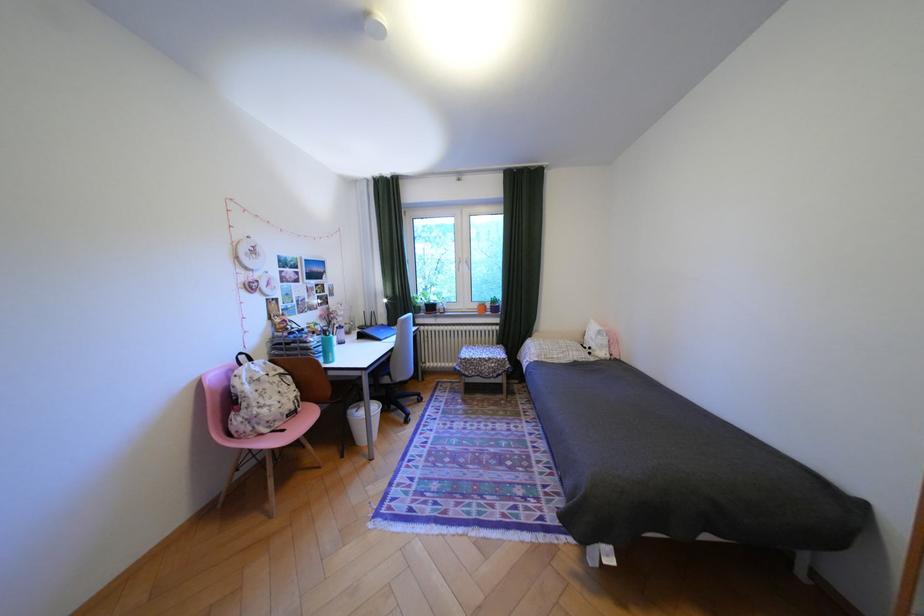
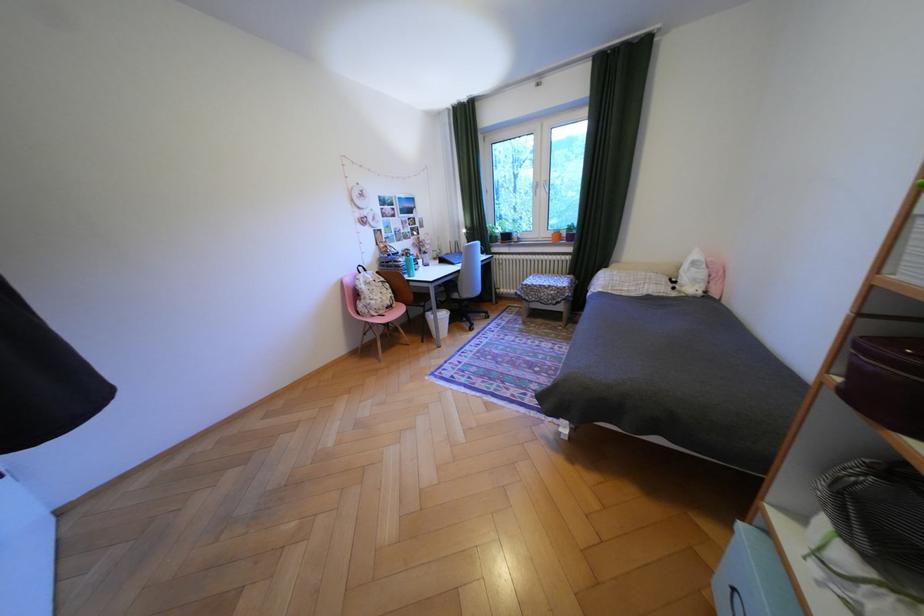
Question: Based on the continuous images, in which direction is the camera rotating? Reply with the corresponding letter.

Choices:
 (A) Left
 (B) Right
 (C) Up
 (D) Down

Answer: (A)